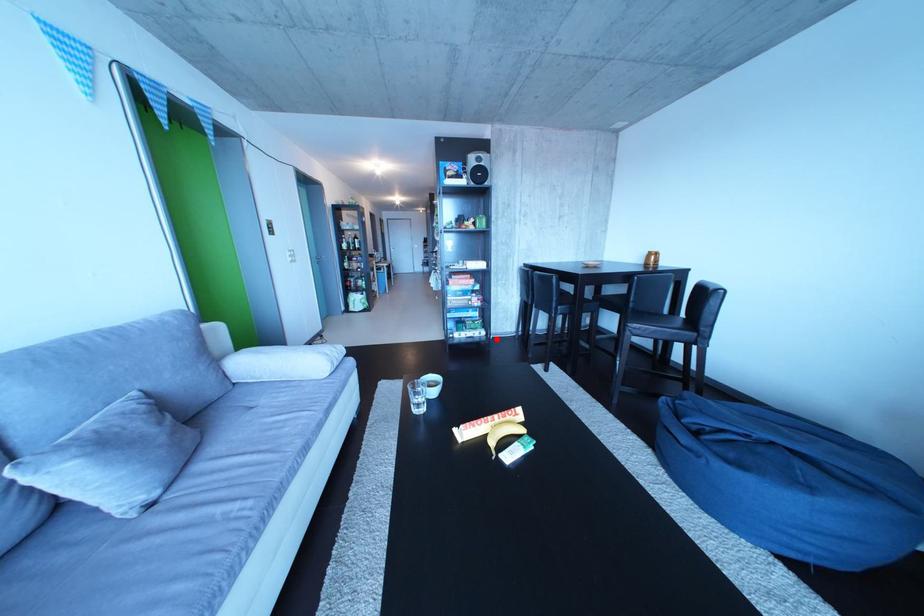
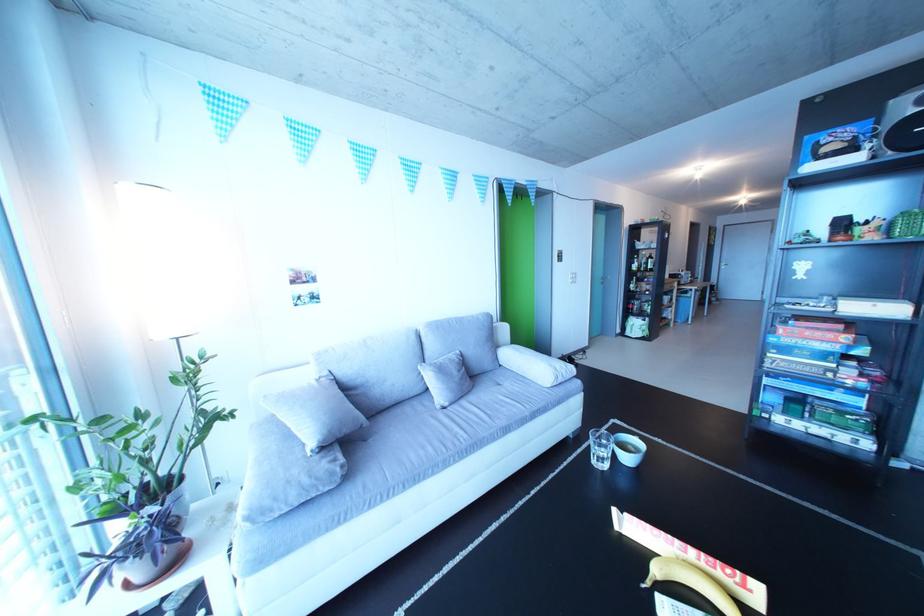
Question: A red point is marked in image1. In image2, is the corresponding 3D point closer to the camera or farther? Reply with the corresponding letter.

Choices:
 (A) The corresponding 3D point is closer.
 (B) The corresponding 3D point is farther.

Answer: (A)